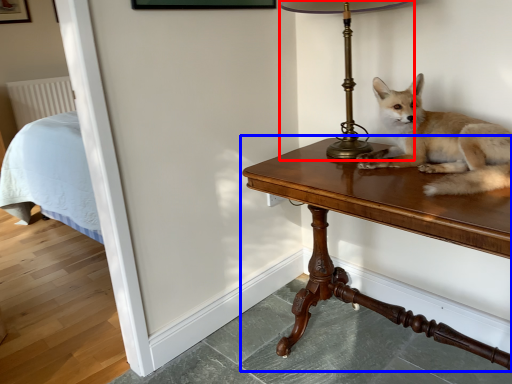
Question: Which object appears farthest to the camera in this image, table lamp (highlighted by a red box) or table (highlighted by a blue box)?

Choices:
 (A) table lamp
 (B) table

Answer: (A)